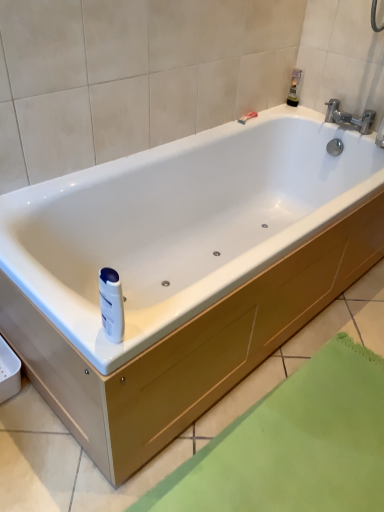
Question: Considering the relative positions of matte plastic razor at upper right and silver metallic faucet at upper right in the image provided, is matte plastic razor at upper right in front of silver metallic faucet at upper right?

Choices:
 (A) yes
 (B) no

Answer: (B)

Question: Can you confirm if matte plastic razor at upper right is thinner than silver metallic faucet at upper right?

Choices:
 (A) no
 (B) yes

Answer: (B)

Question: Considering the relative sizes of matte plastic razor at upper right and silver metallic faucet at upper right in the image provided, is matte plastic razor at upper right bigger than silver metallic faucet at upper right?

Choices:
 (A) no
 (B) yes

Answer: (A)

Question: Does matte plastic razor at upper right contain silver metallic faucet at upper right?

Choices:
 (A) no
 (B) yes

Answer: (A)

Question: Could you tell me if matte plastic razor at upper right is facing silver metallic faucet at upper right?

Choices:
 (A) yes
 (B) no

Answer: (A)

Question: Would you say translucent plastic bottle at upper right, marked as the second toiletry in a bottom-to-top arrangement, is inside or outside silver metallic faucet at upper right?

Choices:
 (A) outside
 (B) inside

Answer: (A)

Question: Considering the positions of translucent plastic bottle at upper right, arranged as the second toiletry when viewed from the front, and silver metallic faucet at upper right in the image, is translucent plastic bottle at upper right, arranged as the second toiletry when viewed from the front, taller or shorter than silver metallic faucet at upper right?

Choices:
 (A) tall
 (B) short

Answer: (A)

Question: Considering the positions of translucent plastic bottle at upper right, the first toiletry in the right-to-left sequence, and silver metallic faucet at upper right in the image, is translucent plastic bottle at upper right, the first toiletry in the right-to-left sequence, bigger or smaller than silver metallic faucet at upper right?

Choices:
 (A) big
 (B) small

Answer: (B)

Question: Considering their positions, is translucent plastic bottle at upper right, arranged as the second toiletry when viewed from the front, located in front of or behind silver metallic faucet at upper right?

Choices:
 (A) front
 (B) behind

Answer: (B)

Question: In the image, is matte plastic razor at upper right on the left side or the right side of translucent plastic bottle at upper right, which is the 1th toiletry from back to front?

Choices:
 (A) right
 (B) left

Answer: (B)

Question: Does point (246, 116) appear closer or farther from the camera than point (291, 81)?

Choices:
 (A) closer
 (B) farther

Answer: (A)

Question: In terms of width, does matte plastic razor at upper right look wider or thinner when compared to translucent plastic bottle at upper right, which is the 1th toiletry from back to front?

Choices:
 (A) wide
 (B) thin

Answer: (B)

Question: From the image's perspective, is matte plastic razor at upper right located above or below translucent plastic bottle at upper right, the first toiletry in the right-to-left sequence?

Choices:
 (A) below
 (B) above

Answer: (A)

Question: Is white plastic bottle at center, the first toiletry viewed from the front, wider or thinner than silver metallic faucet at upper right?

Choices:
 (A) wide
 (B) thin

Answer: (B)

Question: Would you say white plastic bottle at center, which is the 2th toiletry from right to left, is to the left or to the right of silver metallic faucet at upper right in the picture?

Choices:
 (A) left
 (B) right

Answer: (A)